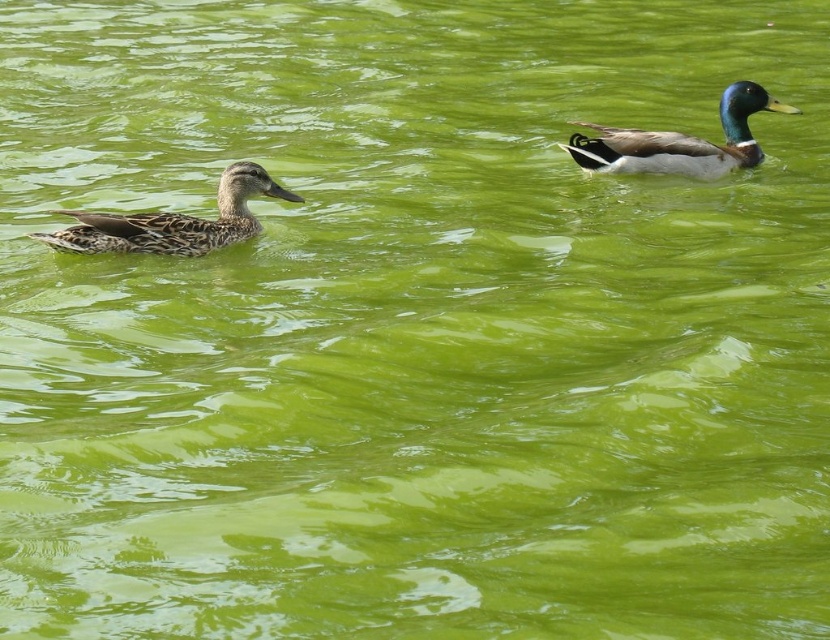
Does speckled brown duck at left appear on the left side of shiny green and brown duck at upper right?

Yes, speckled brown duck at left is to the left of shiny green and brown duck at upper right.

Consider the image. Between speckled brown duck at left and shiny green and brown duck at upper right, which one is positioned higher?

shiny green and brown duck at upper right is above.

What do you see at coordinates (172, 221) in the screenshot?
I see `speckled brown duck at left` at bounding box center [172, 221].

Image resolution: width=830 pixels, height=640 pixels. I want to click on speckled brown duck at left, so click(x=172, y=221).